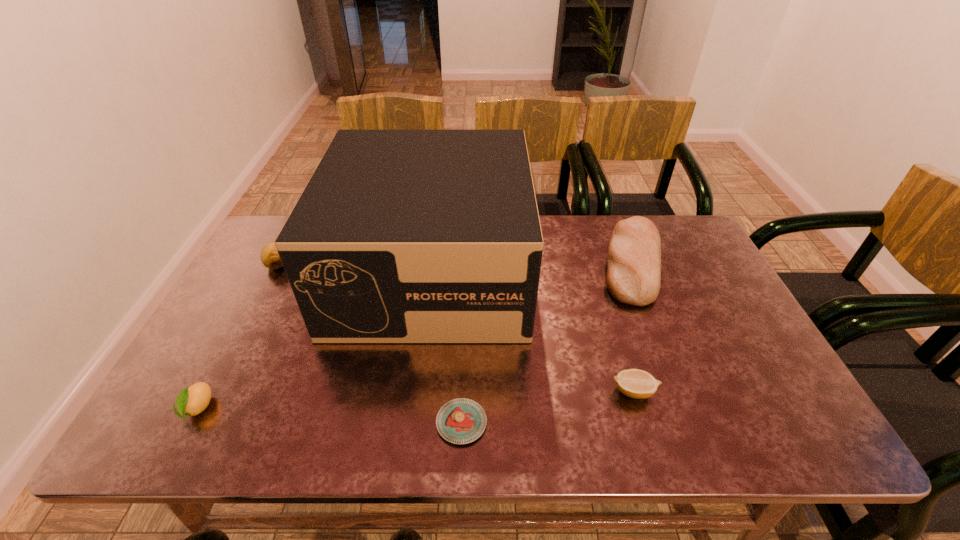
At what (x,y) coordinates should I click in order to perform the action: click on the tallest object. Please return your answer as a coordinate pair (x, y). The image size is (960, 540). Looking at the image, I should click on (400, 236).

Find the location of `the fifth shortest object`. the fifth shortest object is located at coordinates (633, 277).

Find the location of `the farthest lemon`. the farthest lemon is located at coordinates (270, 258).

Identify the location of the rightmost lemon. This screenshot has width=960, height=540. (634, 383).

This screenshot has width=960, height=540. I want to click on the fifth tallest object, so click(634, 383).

Where is `pastry`? This screenshot has height=540, width=960. pastry is located at coordinates (460, 421).

The height and width of the screenshot is (540, 960). What are the coordinates of `vacant space situated 0.170m on the front-facing side of the box` in the screenshot? It's located at (415, 403).

The image size is (960, 540). Find the location of `free space located 0.140m on the right of the bread`. free space located 0.140m on the right of the bread is located at coordinates (711, 263).

You are a GUI agent. You are given a task and a screenshot of the screen. Output one action in this format:
    pyautogui.click(x=<x>, y=<y>)
    Task: Click on the vacant region located at the stem end of the farthest lemon
    
    Given the screenshot: What is the action you would take?
    pyautogui.click(x=252, y=312)

Identify the location of vacant space located on the left of the rightmost lemon. (491, 392).